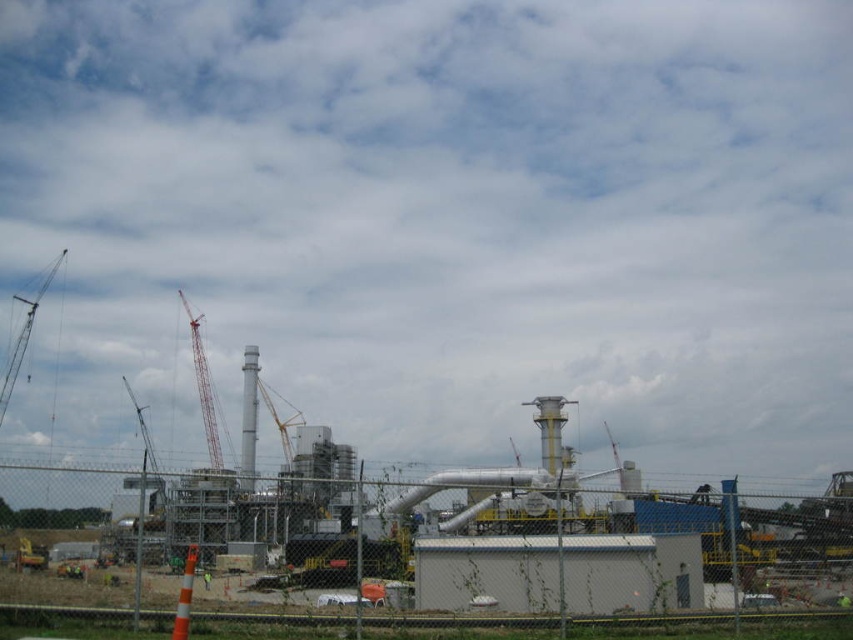
The image size is (853, 640). Find the location of `white matte building at center`. white matte building at center is located at coordinates (718, 628).

Which is behind, point (672, 632) or point (57, 264)?

Point (57, 264)

Does point (697, 634) come behind point (4, 410)?

No, it is not.

This screenshot has width=853, height=640. In order to click on white matte building at center in this screenshot , I will do `click(718, 628)`.

Is white matte building at center smaller than metallic gray crane at left?

Yes.

Does white matte building at center appear under metallic gray crane at left?

No.

Identify the location of white matte building at center. This screenshot has height=640, width=853. (718, 628).

Between red painted metal crane at center and metallic gray crane at upper left, which one appears on the right side from the viewer's perspective?

red painted metal crane at center

In the scene shown: Who is more forward, (201,342) or (57,262)?

Positioned in front is point (201,342).

Where is `red painted metal crane at center`? This screenshot has height=640, width=853. red painted metal crane at center is located at coordinates (202, 387).